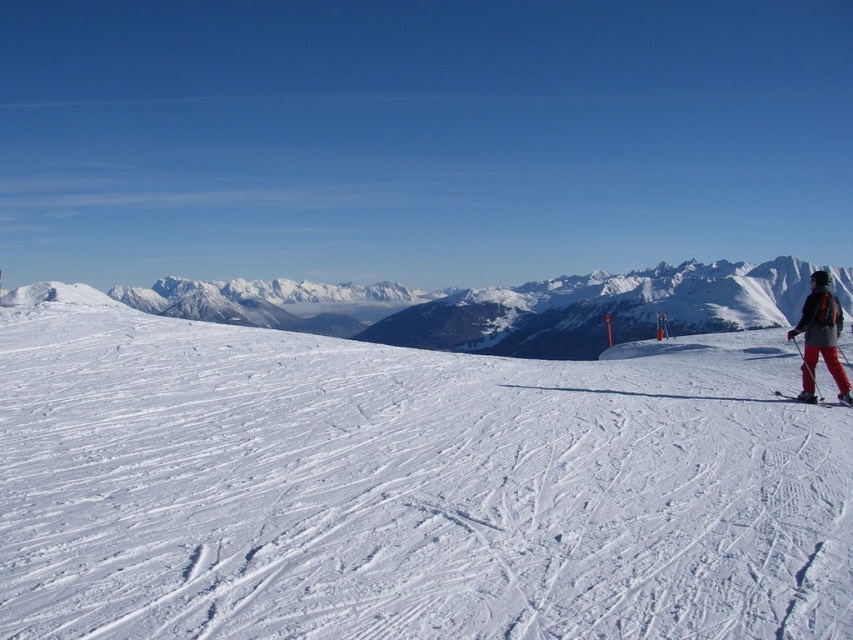
Which is in front, point (822, 307) or point (813, 397)?

Point (813, 397) is in front.

This screenshot has height=640, width=853. I want to click on red ski pants at right, so click(x=820, y=337).

Who is lower down, white powdery snow at center or matte red ski at lower right?

matte red ski at lower right is below.

Does point (628, 365) come closer to viewer compared to point (824, 400)?

That is False.

This screenshot has width=853, height=640. What do you see at coordinates (407, 486) in the screenshot?
I see `white powdery snow at center` at bounding box center [407, 486].

Image resolution: width=853 pixels, height=640 pixels. Find the location of `white powdery snow at center`. white powdery snow at center is located at coordinates (407, 486).

Who is higher up, white powdery snow at center or red ski pants at right?

white powdery snow at center is higher up.

Locate an element on the screen. white powdery snow at center is located at coordinates (407, 486).

You are a GUI agent. You are given a task and a screenshot of the screen. Output one action in this format:
    pyautogui.click(x=<x>, y=<y>)
    Task: Click on the white powdery snow at center
    The width and height of the screenshot is (853, 640).
    Given the screenshot: What is the action you would take?
    pyautogui.click(x=407, y=486)